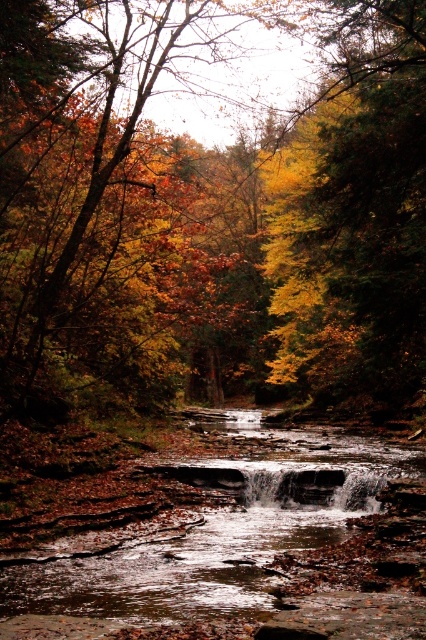
You are standing at the point closer to the stream in the autumn forest scene. There are two points marked in the image. Which point, point (120, 118) or point (91, 589), is farther away from you?

Point (120, 118) is farther away from you because it is behind point (91, 589), which is closer to you.